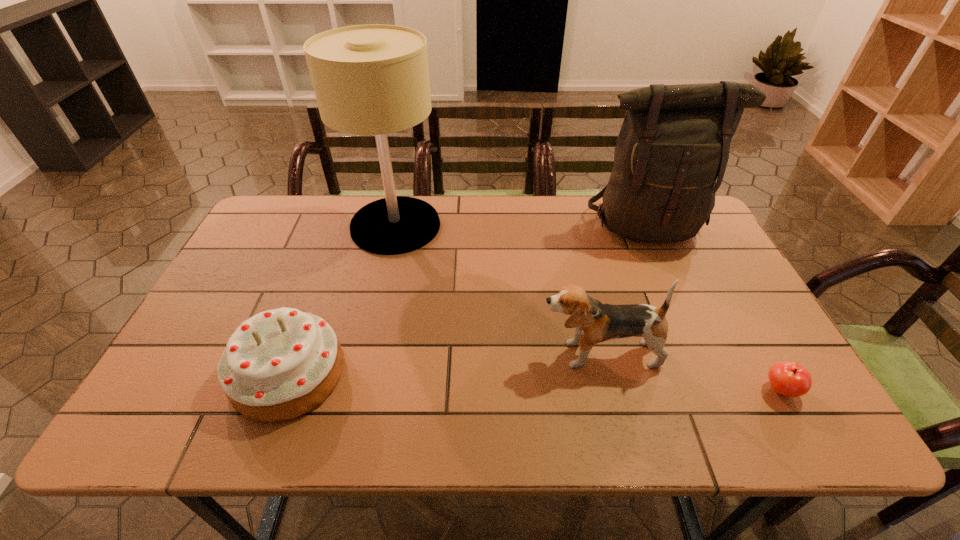
Image resolution: width=960 pixels, height=540 pixels. Find the location of `free area in between the cake and the apple`. free area in between the cake and the apple is located at coordinates (535, 382).

The image size is (960, 540). Identify the location of empty space between the table lamp and the fourth tallest object. (342, 300).

The image size is (960, 540). What are the coordinates of `free point between the tallest object and the backpack` in the screenshot? It's located at (521, 226).

Identify the location of unoccupied position between the apple and the third tallest object. This screenshot has width=960, height=540. (x=689, y=372).

What are the coordinates of `free area in between the backpack and the tallest object` in the screenshot? It's located at (x=521, y=226).

Identify the location of vacant space in between the backpack and the apple. This screenshot has height=540, width=960. (713, 308).

Identify the location of free spot between the cake and the backpack. This screenshot has height=540, width=960. (468, 300).

Locate which object ranks fourth in proximity to the apple. Please provide its 2D coordinates. Your answer should be formatted as a tuple, i.e. [(x, y)], where the tuple contains the x and y coordinates of a point satisfying the conditions above.

[(279, 364)]

You are a GUI agent. You are given a task and a screenshot of the screen. Output one action in this format:
    pyautogui.click(x=<x>, y=<y>)
    Task: Click on the object that is the fourth nearest to the cake
    The height and width of the screenshot is (540, 960).
    Given the screenshot: What is the action you would take?
    pyautogui.click(x=788, y=378)

Locate an element on the screen. This screenshot has height=540, width=960. free space that satisfies the following two spatial constraints: 1. at the face of the puppy; 2. on the back side of the shortest object is located at coordinates (607, 390).